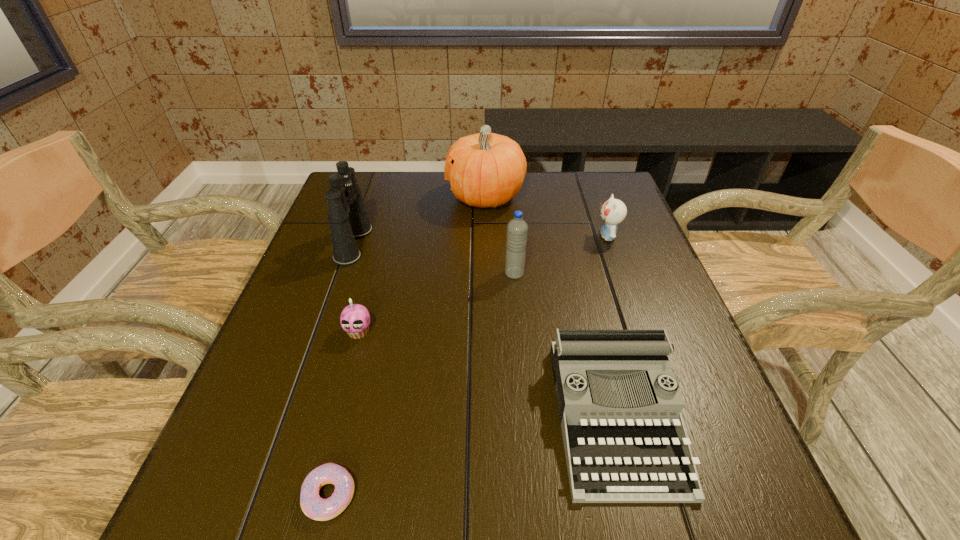
Identify the location of free area in between the cupcake and the leftmost object. (356, 288).

You are a GUI agent. You are given a task and a screenshot of the screen. Output one action in this format:
    pyautogui.click(x=<x>, y=<y>)
    Task: Click on the free space between the farthest object and the doughnut
    Image resolution: width=960 pixels, height=540 pixels.
    Given the screenshot: What is the action you would take?
    pyautogui.click(x=407, y=346)

Where is `empty space that is in between the doughnut and the third tallest object`? The image size is (960, 540). empty space that is in between the doughnut and the third tallest object is located at coordinates (421, 384).

Select which object appears as the third closest to the fifth farthest object. Please provide its 2D coordinates. Your answer should be formatted as a tuple, i.e. [(x, y)], where the tuple contains the x and y coordinates of a point satisfying the conditions above.

[(517, 229)]

Locate an element on the screen. The width and height of the screenshot is (960, 540). object that stands as the closest to the fourth nearest object is located at coordinates (485, 169).

You are a GUI agent. You are given a task and a screenshot of the screen. Output one action in this format:
    pyautogui.click(x=<x>, y=<y>)
    Task: Click on the vacant position in the image that satisfies the following two spatial constraints: 1. on the front-facing side of the third tallest object; 2. on the left side of the pumpkin
    
    Given the screenshot: What is the action you would take?
    pyautogui.click(x=487, y=274)

Locate an element on the screen. free space that satisfies the following two spatial constraints: 1. on the front-facing side of the pumpkin; 2. on the left side of the fourth nearest object is located at coordinates (487, 274).

Identify the location of vacant space that satisfies the following two spatial constraints: 1. on the front-facing side of the farthest object; 2. on the left side of the water bottle. The image size is (960, 540). (487, 274).

Identify the location of vacant region that satisfies the following two spatial constraints: 1. on the front side of the shortest object; 2. on the left side of the leftmost object. (267, 495).